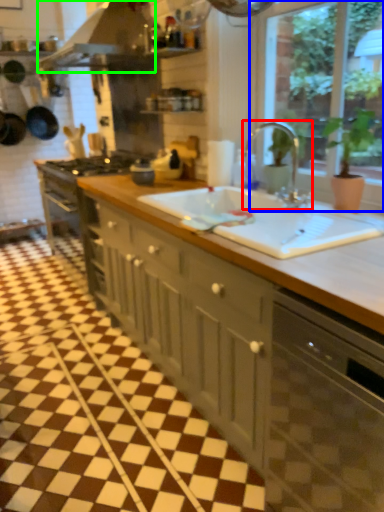
Question: Based on their relative distances, which object is nearer to tap (highlighted by a red box)? Choose from window (highlighted by a blue box) and exhaust hood (highlighted by a green box).

Choices:
 (A) window
 (B) exhaust hood

Answer: (A)